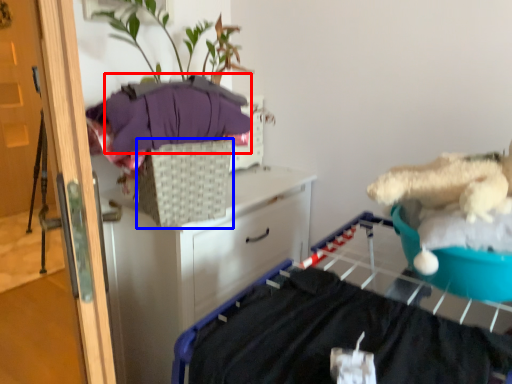
Question: Which of the following is the farthest to the observer, clothing (highlighted by a red box) or basket (highlighted by a blue box)?

Choices:
 (A) clothing
 (B) basket

Answer: (B)